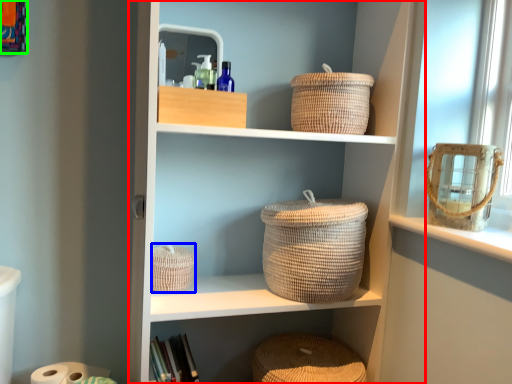
Question: Considering the real-world distances, which object is farthest from shelf (highlighted by a red box)? basket (highlighted by a blue box) or picture frame (highlighted by a green box)?

Choices:
 (A) basket
 (B) picture frame

Answer: (B)